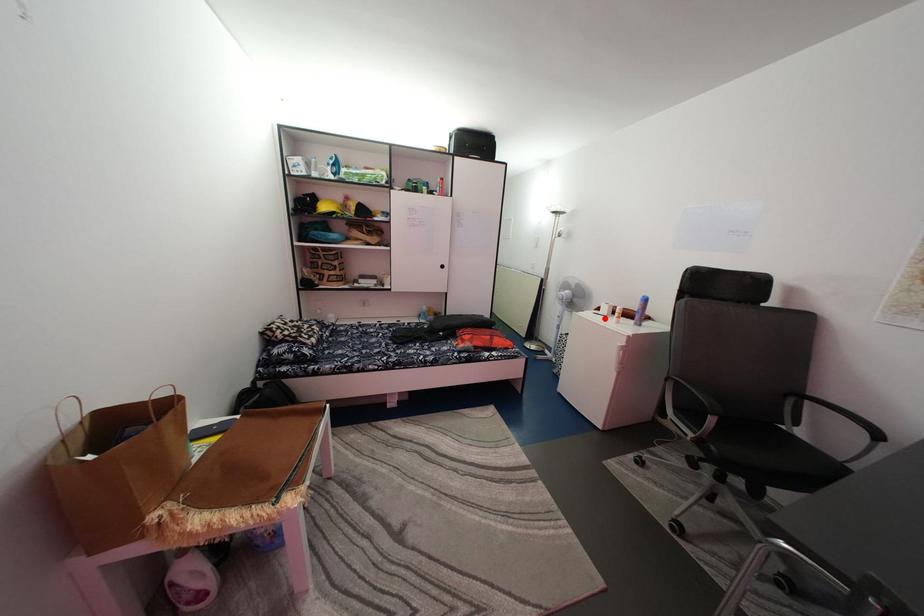
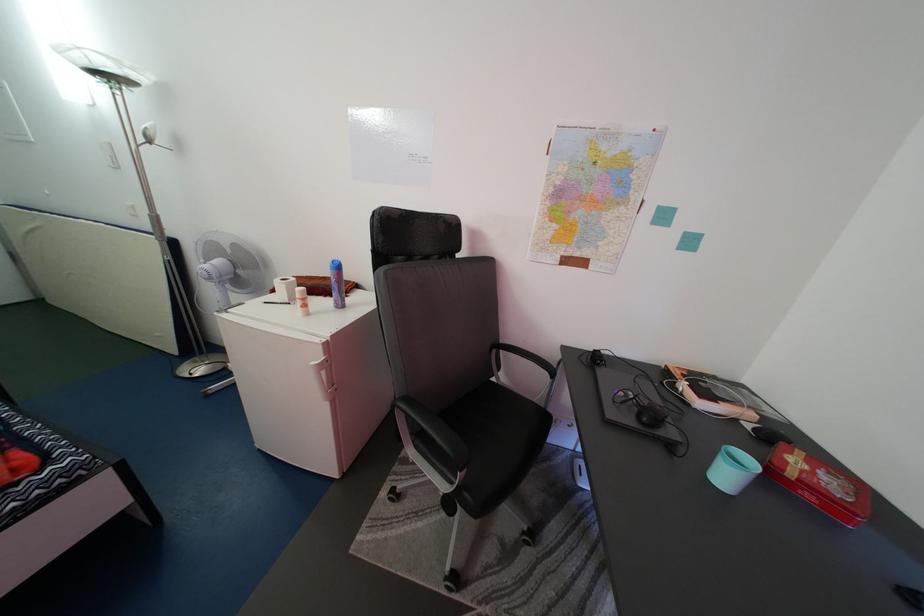
Question: I am providing you with two images of the same scene from different viewpoints. In image1, a red point is highlighted. Considering the same 3D point in image2, which of the following is correct?

Choices:
 (A) It is closer
 (B) It is farther

Answer: (B)